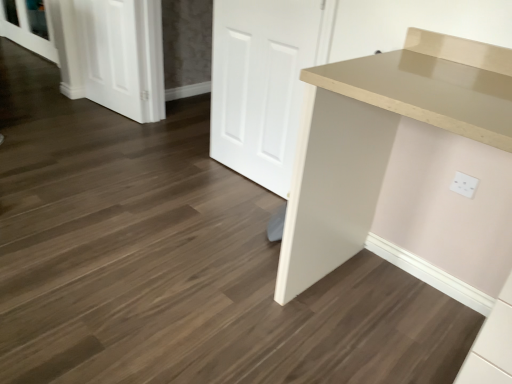
In order to face white matte door at center, should I rotate leftwards or rightwards?

To face it directly, rotate right by 0.290 degrees.

Identify the location of white matte door at center. (260, 84).

This screenshot has height=384, width=512. What do you see at coordinates (260, 84) in the screenshot? I see `white matte door at center` at bounding box center [260, 84].

Where is `white matte door at center`? The height and width of the screenshot is (384, 512). white matte door at center is located at coordinates (260, 84).